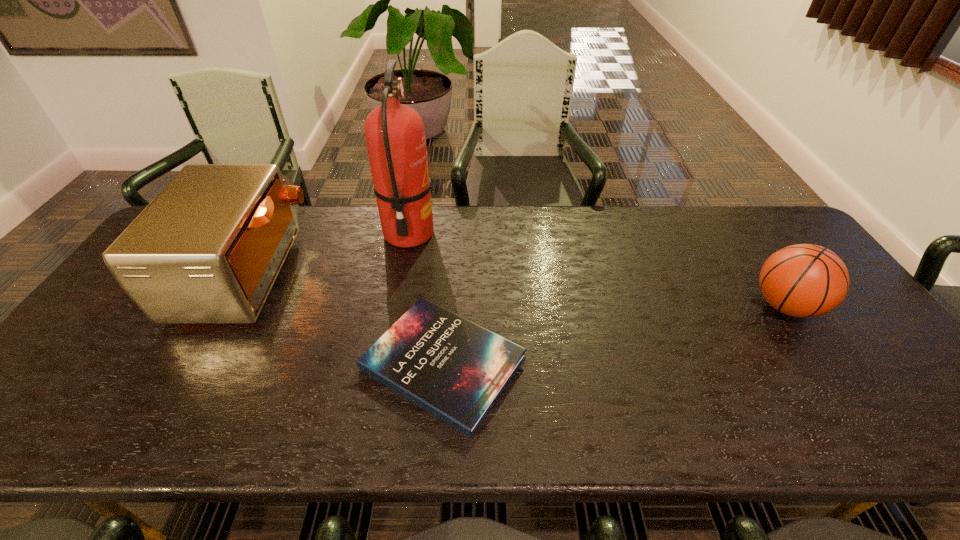
Identify the location of vacant space that's between the leftmost object and the hardback book. This screenshot has width=960, height=540. (346, 319).

Identify the location of free point between the hardback book and the fire extinguisher. (426, 299).

You are a GUI agent. You are given a task and a screenshot of the screen. Output one action in this format:
    pyautogui.click(x=<x>, y=<y>)
    Task: Click on the unoccupied area between the basketball and the hardback book
    This screenshot has height=540, width=960.
    Given the screenshot: What is the action you would take?
    pyautogui.click(x=614, y=335)

The width and height of the screenshot is (960, 540). What are the coordinates of `unoccupied position between the hardback book and the basketball` in the screenshot? It's located at 614,335.

This screenshot has width=960, height=540. Identify the location of free space between the third tallest object and the fire extinguisher. [597, 270].

Locate an element on the screen. The image size is (960, 540). free space between the tallest object and the second shortest object is located at coordinates (597, 270).

This screenshot has width=960, height=540. Find the location of `vacant area that lies between the second shortest object and the hardback book`. vacant area that lies between the second shortest object and the hardback book is located at coordinates (614, 335).

This screenshot has height=540, width=960. Identify the location of free spot between the leftmost object and the fire extinguisher. (328, 254).

Locate which object ranks second in proximity to the second tallest object. Please provide its 2D coordinates. Your answer should be formatted as a tuple, i.e. [(x, y)], where the tuple contains the x and y coordinates of a point satisfying the conditions above.

[(455, 369)]

Identify which object is located as the third nearest to the tallest object. Please provide its 2D coordinates. Your answer should be formatted as a tuple, i.e. [(x, y)], where the tuple contains the x and y coordinates of a point satisfying the conditions above.

[(804, 280)]